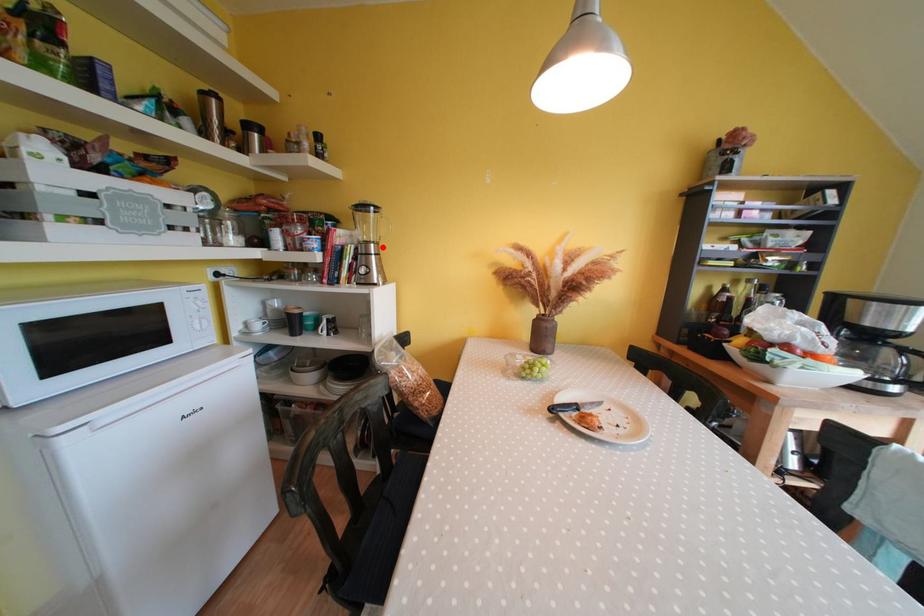
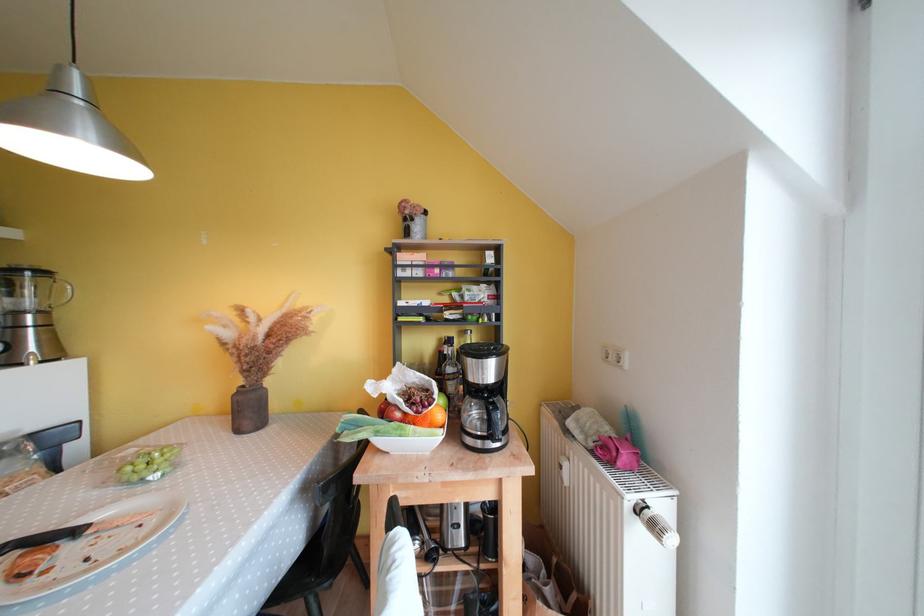
In the second image, find the point that corresponds to the highlighted location in the first image.

(49, 315)